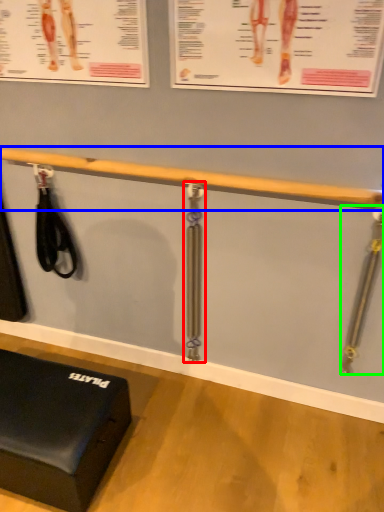
Question: Which object is positioned farthest from tool (highlighted by a red box)? Select from beam (highlighted by a blue box) and tool (highlighted by a green box).

Choices:
 (A) beam
 (B) tool

Answer: (B)